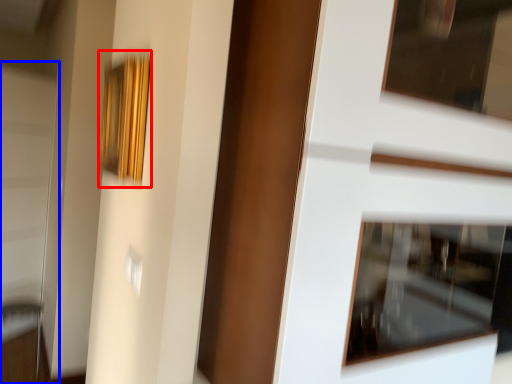
Question: Which of the following is the farthest to the observer, picture frame (highlighted by a red box) or screen door (highlighted by a blue box)?

Choices:
 (A) picture frame
 (B) screen door

Answer: (B)